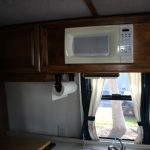
Find the location of a particular element. The image size is (150, 150). digital display is located at coordinates (125, 29).